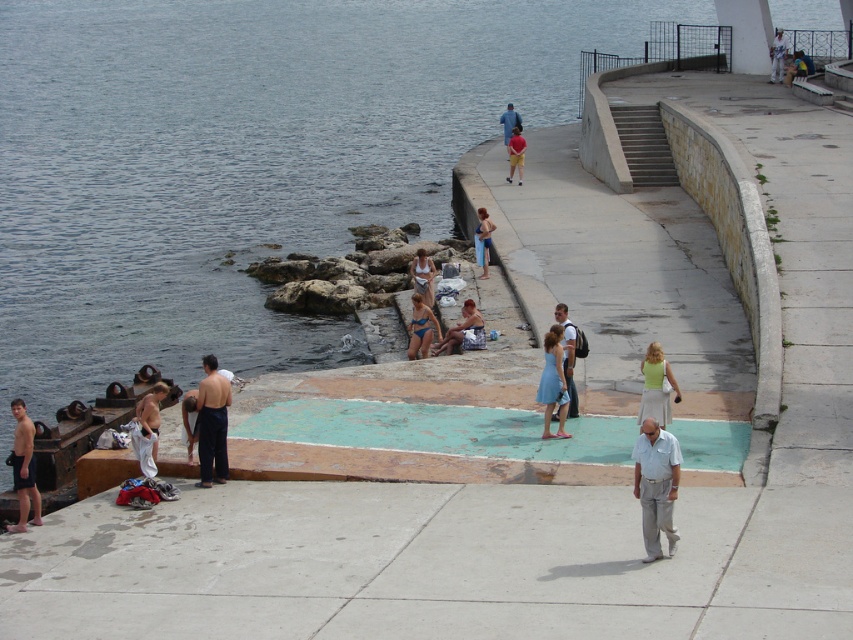
Who is more distant from viewer, (212, 422) or (511, 170)?

The point (511, 170) is behind.

Between dark blue pants at lower left and red cotton shorts at center, which one is positioned lower?

dark blue pants at lower left

Does point (210, 401) lie behind point (521, 163)?

No.

Find the location of a particular element. This screenshot has width=853, height=640. dark blue pants at lower left is located at coordinates (212, 422).

Between point (212, 364) and point (450, 332), which one is positioned in front?

Positioned in front is point (212, 364).

Find the location of `dark blue pants at lower left`. dark blue pants at lower left is located at coordinates (212, 422).

Does point (651, 500) lie behind point (467, 305)?

No.

Which is below, light gray cotton pants at lower right or matte blue swimsuit at center?

Positioned lower is light gray cotton pants at lower right.

Between point (646, 524) and point (460, 333), which one is positioned in front?

Point (646, 524) is more forward.

Locate an element on the screen. Image resolution: width=853 pixels, height=640 pixels. light gray cotton pants at lower right is located at coordinates (656, 484).